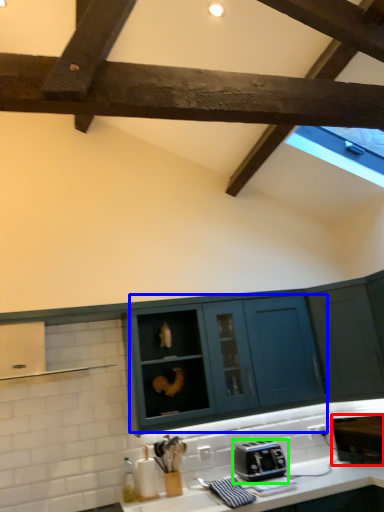
Question: Based on their relative distances, which object is farther from appliance (highlighted by a red box)? Choose from cabinetry (highlighted by a blue box) and toaster (highlighted by a green box).

Choices:
 (A) cabinetry
 (B) toaster

Answer: (A)